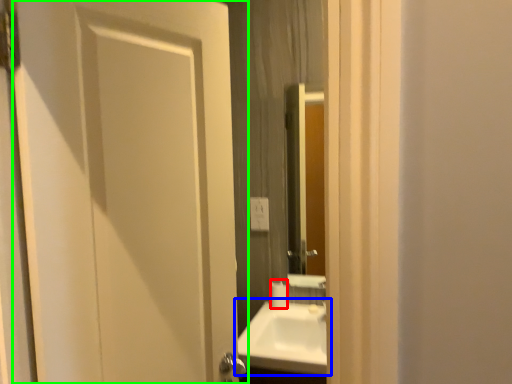
Question: Which object is the farthest from toilet paper (highlighted by a red box)? Choose among these: sink (highlighted by a blue box) or door (highlighted by a green box).

Choices:
 (A) sink
 (B) door

Answer: (B)